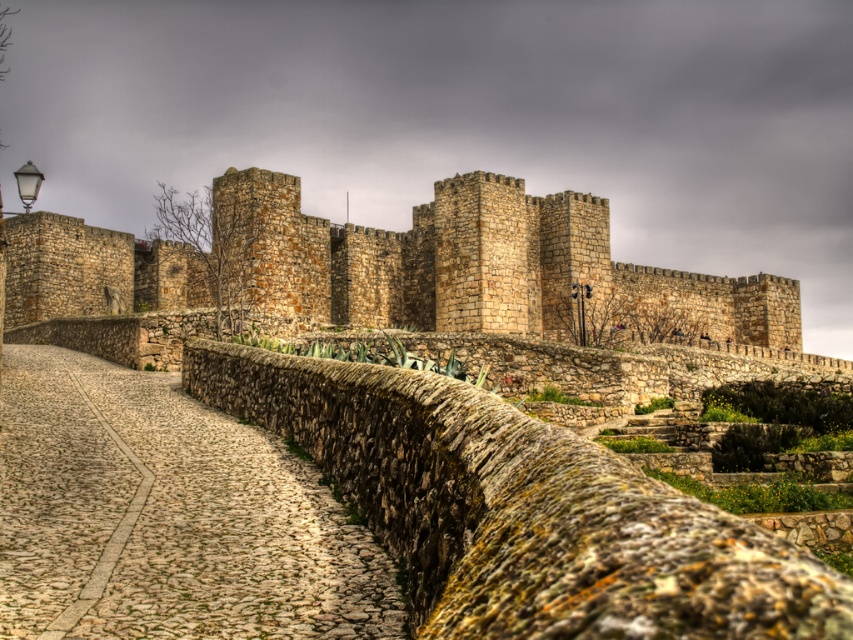
Question: Which object appears farthest from the camera in this image?

Choices:
 (A) cobblestone path at center
 (B) rustic stone castle at center
 (C) green mossy stone wall at center

Answer: (B)

Question: Is green mossy stone wall at center closer to the viewer compared to cobblestone path at center?

Choices:
 (A) yes
 (B) no

Answer: (A)

Question: Among these objects, which one is nearest to the camera?

Choices:
 (A) green mossy stone wall at center
 (B) rustic stone castle at center
 (C) cobblestone path at center

Answer: (A)

Question: Which point appears farthest from the camera in this image?

Choices:
 (A) (30, 401)
 (B) (488, 198)
 (C) (402, 429)

Answer: (B)

Question: Is cobblestone path at center to the left of rustic stone castle at center from the viewer's perspective?

Choices:
 (A) yes
 (B) no

Answer: (A)

Question: Is cobblestone path at center thinner than rustic stone castle at center?

Choices:
 (A) no
 (B) yes

Answer: (B)